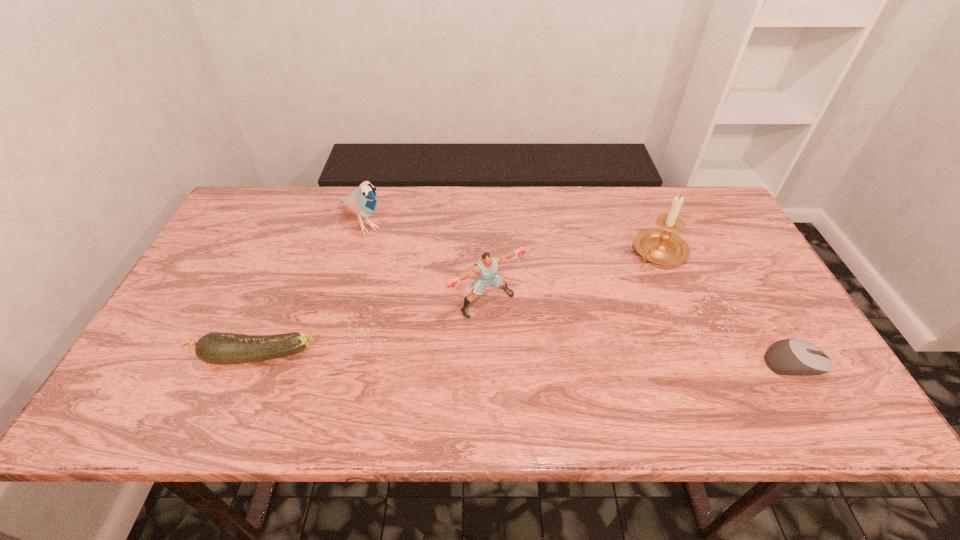
I want to click on object present at the left edge, so (x=218, y=348).

Where is `object that is at the right edge`? This screenshot has width=960, height=540. object that is at the right edge is located at coordinates (794, 357).

Find the location of `object situated at the near left corner`. object situated at the near left corner is located at coordinates (218, 348).

Where is `object that is at the near right corner`? This screenshot has width=960, height=540. object that is at the near right corner is located at coordinates (794, 357).

Where is `vacant space at the far edge`? The height and width of the screenshot is (540, 960). vacant space at the far edge is located at coordinates (359, 232).

In order to click on vacant space at the near edge in this screenshot , I will do `click(550, 362)`.

Identify the location of vacant space at the left edge of the desktop. (211, 259).

This screenshot has width=960, height=540. In order to click on free point at the right edge in this screenshot , I will do `click(729, 268)`.

Locate an element on the screen. This screenshot has height=540, width=960. vacant space at the far left corner is located at coordinates (287, 214).

At what (x,y) coordinates should I click in order to perform the action: click on vacant space that is in between the bird and the zucchini. Please return your answer as a coordinate pair (x, y). Looking at the image, I should click on (309, 290).